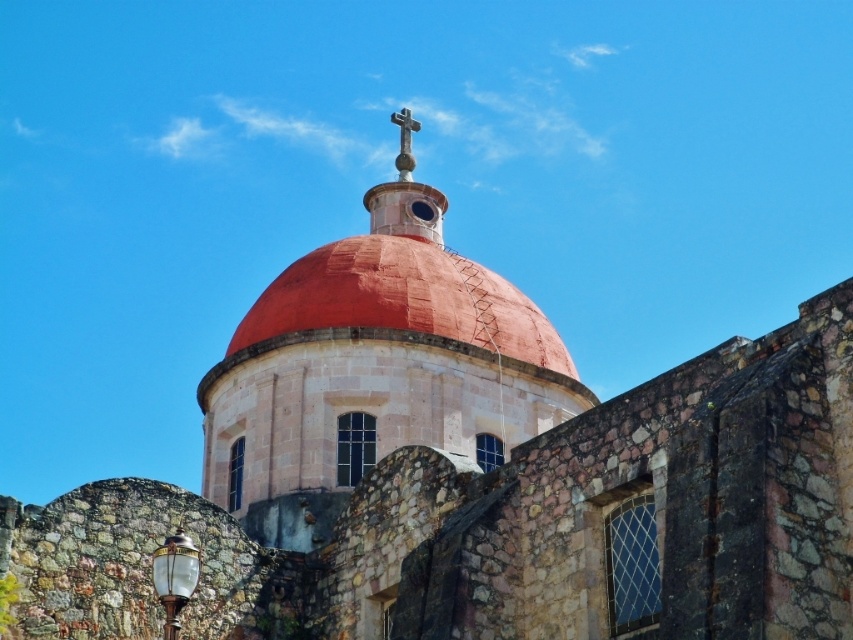
Question: Can you confirm if smooth terracotta dome at center is positioned to the left of metallic cross at center?

Choices:
 (A) yes
 (B) no

Answer: (A)

Question: Which object appears closest to the camera in this image?

Choices:
 (A) metallic cross at center
 (B) smooth terracotta dome at center

Answer: (B)

Question: Is smooth terracotta dome at center closer to the viewer compared to metallic cross at center?

Choices:
 (A) yes
 (B) no

Answer: (A)

Question: Does smooth terracotta dome at center have a larger size compared to metallic cross at center?

Choices:
 (A) no
 (B) yes

Answer: (B)